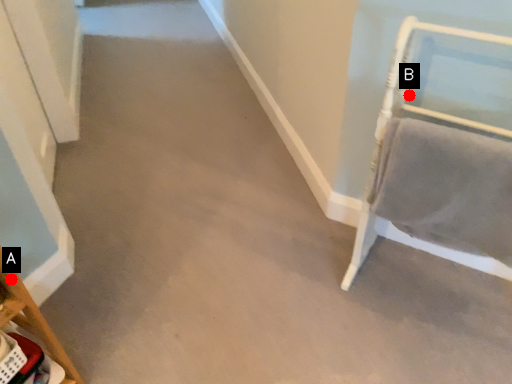
Question: Two points are circled on the image, labeled by A and B beside each circle. Which point appears closest to the camera in this image?

Choices:
 (A) A is closer
 (B) B is closer

Answer: (A)